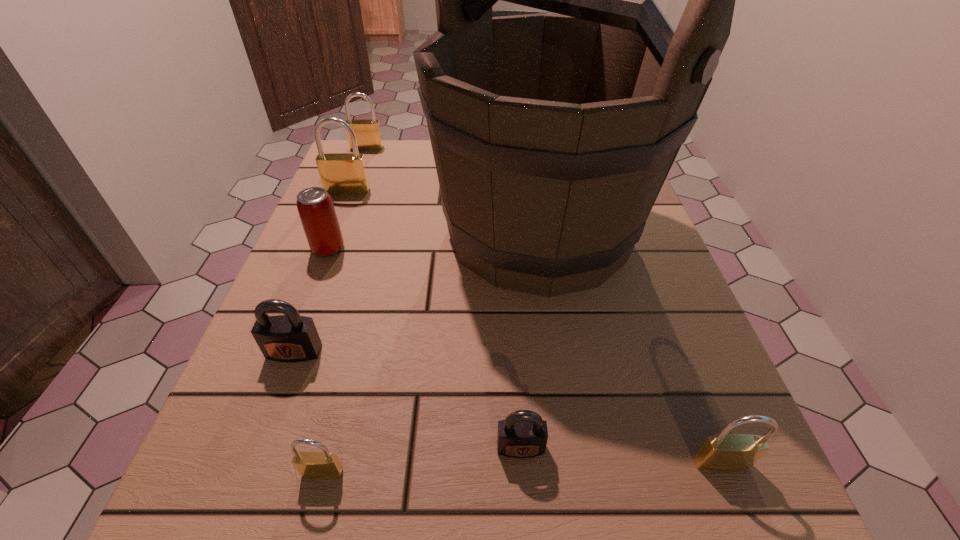
Locate an element on the screen. bucket is located at coordinates (552, 135).

At what (x,y) coordinates should I click in order to perform the action: click on the second farthest padlock. Please return your answer as a coordinate pair (x, y). Looking at the image, I should click on (341, 173).

Where is `the biggest brass padlock`? This screenshot has width=960, height=540. the biggest brass padlock is located at coordinates 341,173.

You are a GUI agent. You are given a task and a screenshot of the screen. Output one action in this format:
    pyautogui.click(x=<x>, y=<y>)
    Task: Click on the farthest padlock
    The width and height of the screenshot is (960, 540).
    Given the screenshot: What is the action you would take?
    pyautogui.click(x=368, y=133)

Find the location of `the farthest brass padlock`. the farthest brass padlock is located at coordinates (368, 133).

Image resolution: width=960 pixels, height=540 pixels. What are the coordinates of `pink beer can` in the screenshot? It's located at (315, 207).

At what (x,y) coordinates should I click in order to perform the action: click on the bigger gray padlock. Please return your answer as a coordinate pair (x, y). The image size is (960, 540). Looking at the image, I should click on (289, 338).

Where is `the fourth nearest object`? The image size is (960, 540). the fourth nearest object is located at coordinates (289, 338).

Image resolution: width=960 pixels, height=540 pixels. I want to click on the third biggest brass padlock, so (724, 452).

You are a GUI agent. You are given a task and a screenshot of the screen. Output one action in this format:
    pyautogui.click(x=<x>, y=<y>)
    Task: Click on the rightmost padlock
    
    Given the screenshot: What is the action you would take?
    pyautogui.click(x=724, y=452)